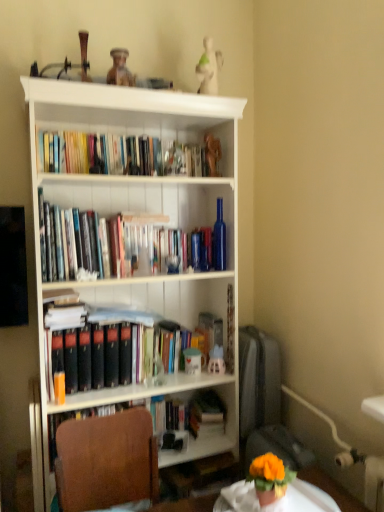
Question: Is brown fabric chair at lower left inside the boundaries of white glossy round table at lower center, or outside?

Choices:
 (A) outside
 (B) inside

Answer: (A)

Question: Considering the relative positions of brown fabric chair at lower left and white glossy round table at lower center in the image provided, is brown fabric chair at lower left to the left or to the right of white glossy round table at lower center?

Choices:
 (A) left
 (B) right

Answer: (A)

Question: Estimate the real-world distances between objects in this image. Which object is closer to the white glossy round table at lower center?

Choices:
 (A) hardcover books at upper left
 (B) matte orange paperback book at left
 (C) gold metallic figurine at upper center, arranged as the 2th toy when ordered from the bottom
 (D) orange matte flower pot at lower right
 (E) matte blue toy at center, which ranks as the second toy in top-to-bottom order

Answer: (D)

Question: Estimate the real-world distances between objects in this image. Which object is farther from the blue glass bottle at center?

Choices:
 (A) hardcover books at upper left
 (B) white glossy round table at lower center
 (C) orange matte flower pot at lower right
 (D) matte blue toy at center, which ranks as the second toy in top-to-bottom order
 (E) white matte bookcase at center

Answer: (B)